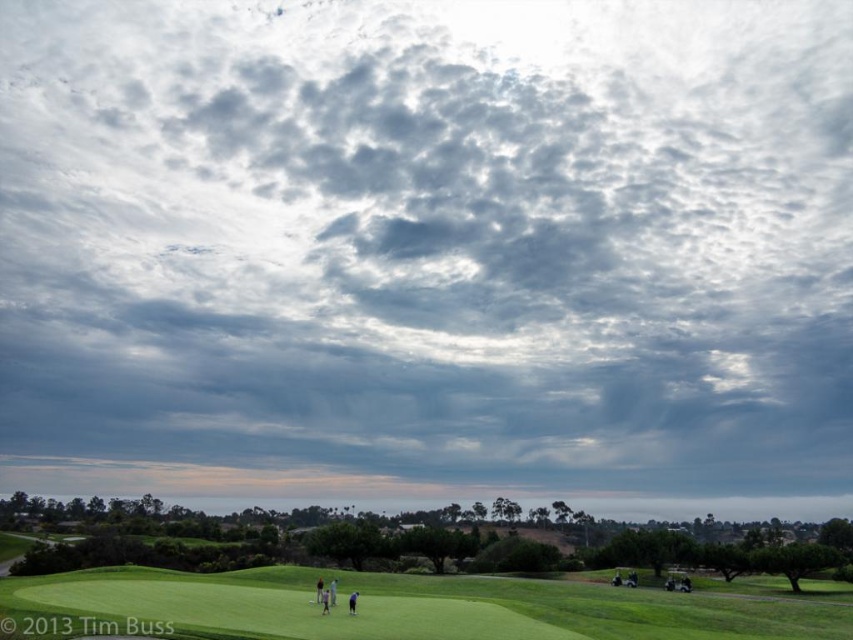
Question: Which object is farther from the camera taking this photo?

Choices:
 (A) green grassy field at lower center
 (B) dark blue shirt at lower center

Answer: (B)

Question: Is green grassy field at lower center smaller than dark blue shirt at lower center?

Choices:
 (A) yes
 (B) no

Answer: (B)

Question: Is green grassy field at lower center bigger than dark blue shirt at lower center?

Choices:
 (A) yes
 (B) no

Answer: (A)

Question: Is green grassy field at lower center closer to camera compared to dark blue shirt at lower center?

Choices:
 (A) no
 (B) yes

Answer: (B)

Question: Which object appears farthest from the camera in this image?

Choices:
 (A) green grassy field at lower center
 (B) dark blue shirt at lower center

Answer: (B)